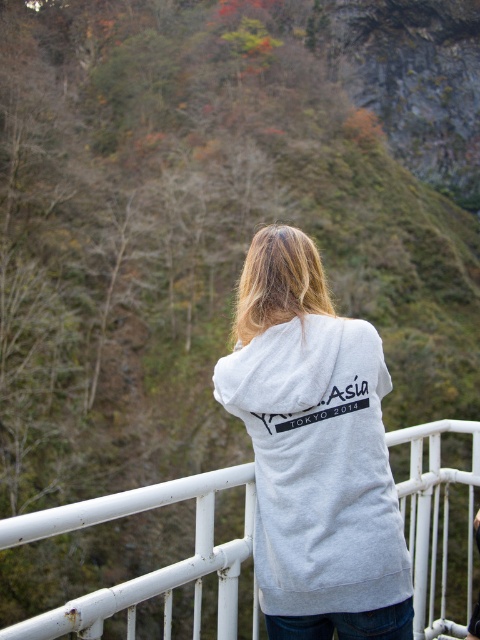
You are a photographer trying to capture the scene of the person wearing the gray cotton hoodie at center standing on the white metal railing at center. From the description, can you determine if the hoodie is above or below the railing?

The gray cotton hoodie at center is located above the white metal railing at center, so the hoodie is above the railing.

Where is the gray cotton hoodie at center located in the image?

The gray cotton hoodie at center is located at point (314,451) in the image.